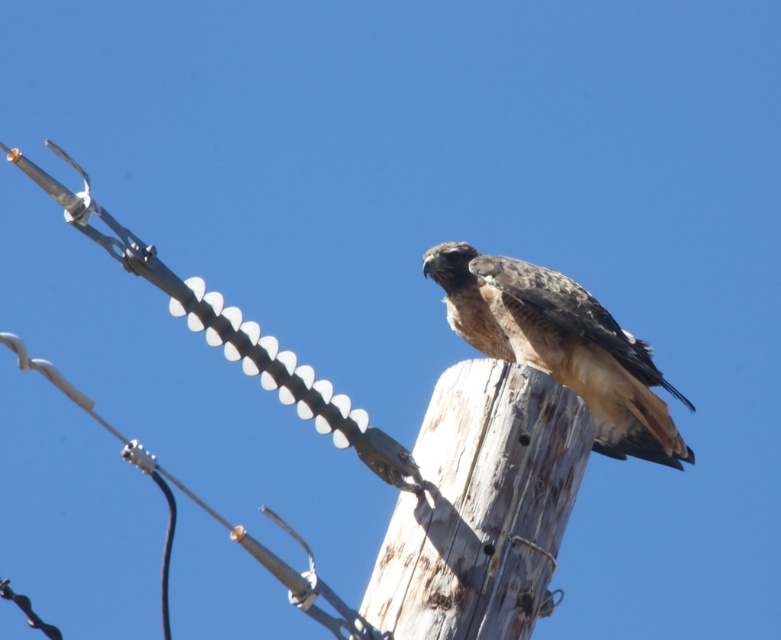
Question: Does weathered wood pole at center have a lesser width compared to brown feathered falcon at center?

Choices:
 (A) yes
 (B) no

Answer: (A)

Question: Which of the following is the closest to the observer?

Choices:
 (A) (596, 358)
 (B) (514, 410)

Answer: (B)

Question: Where is weathered wood pole at center located in relation to brown feathered falcon at center in the image?

Choices:
 (A) right
 (B) left

Answer: (B)

Question: Is weathered wood pole at center bigger than brown feathered falcon at center?

Choices:
 (A) yes
 (B) no

Answer: (B)

Question: Which point appears farthest from the camera in this image?

Choices:
 (A) (525, 557)
 (B) (557, 282)

Answer: (B)